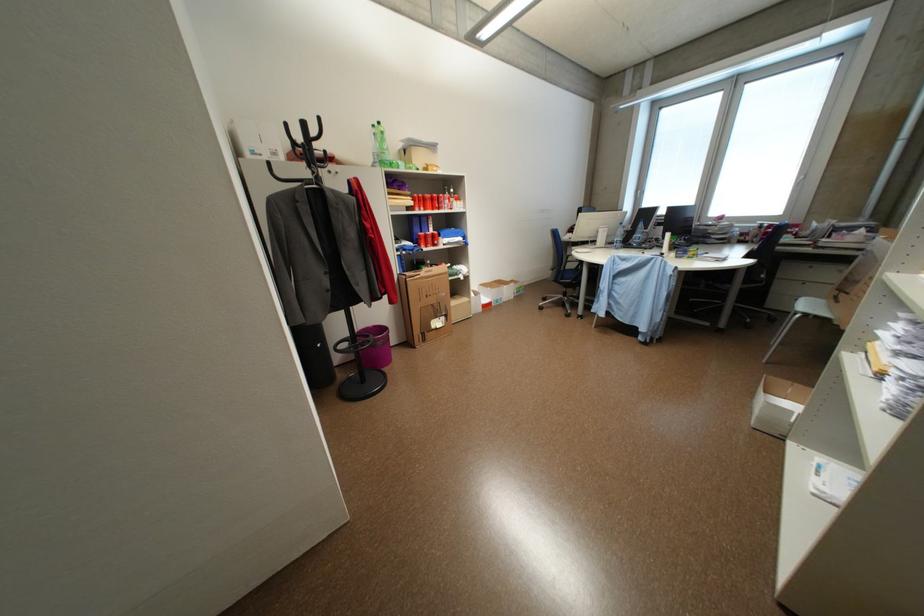
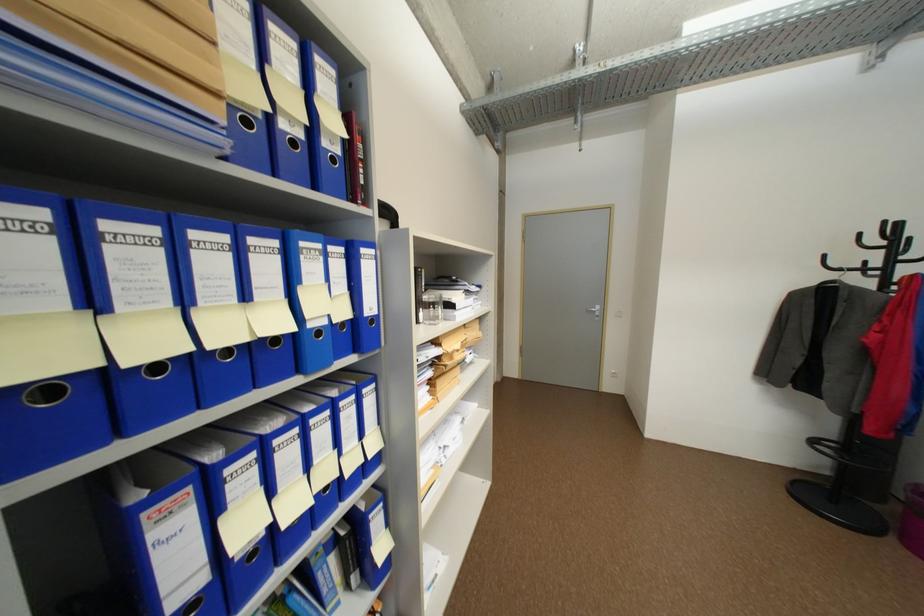
The point at (327,120) is marked in the first image. Where is the corresponding point in the second image?

(893, 224)